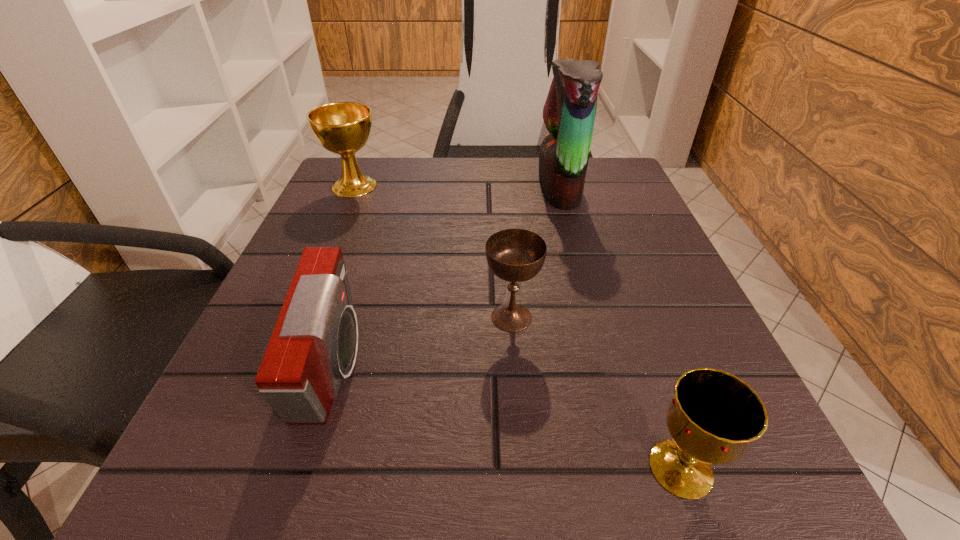
In order to click on vacant space located on the front of the tallest chalice in this screenshot , I will do `click(327, 249)`.

Locate an element on the screen. The width and height of the screenshot is (960, 540). vacant space situated on the front of the second nearest chalice is located at coordinates (526, 507).

Locate an element on the screen. free region located on the front-facing side of the camera is located at coordinates (454, 368).

Where is `free space located 0.180m on the back of the nearest chalice`? The width and height of the screenshot is (960, 540). free space located 0.180m on the back of the nearest chalice is located at coordinates (631, 326).

Locate an element on the screen. parrot present at the far edge is located at coordinates (569, 112).

Find the location of a particular element. The height and width of the screenshot is (540, 960). chalice present at the far edge is located at coordinates (343, 128).

You are a GUI agent. You are given a task and a screenshot of the screen. Output one action in this format:
    pyautogui.click(x=<x>, y=<y>)
    Task: Click on the camera that is at the near edge
    
    Given the screenshot: What is the action you would take?
    pyautogui.click(x=314, y=344)

At what (x,y) coordinates should I click in order to perform the action: click on chalice that is at the near edge. Please return your answer as a coordinate pair (x, y). The width and height of the screenshot is (960, 540). Looking at the image, I should click on (714, 415).

The image size is (960, 540). I want to click on chalice at the left edge, so click(343, 128).

Where is `camera that is at the left edge`? The image size is (960, 540). camera that is at the left edge is located at coordinates (314, 344).